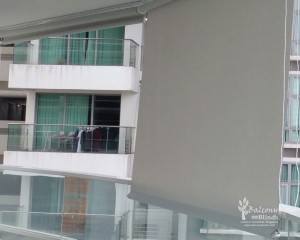
Locate an element on the screen. The width and height of the screenshot is (300, 240). glass is located at coordinates (45, 194), (48, 135), (51, 54).